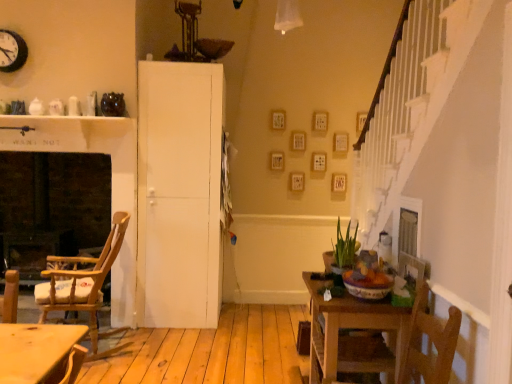
At what (x,y) coordinates should I click in order to perform the action: click on vacant area that lies to the right of white matte door at center. Please return your answer as a coordinate pair (x, y). The width and height of the screenshot is (512, 384). Looking at the image, I should click on 251,321.